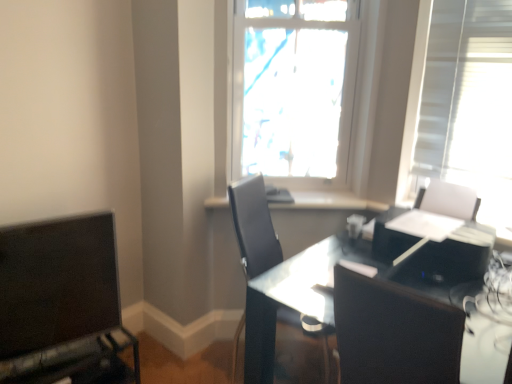
Find the location of a particular element. free region under matte black monitor at lower left (from a real-world perspective) is located at coordinates (48, 356).